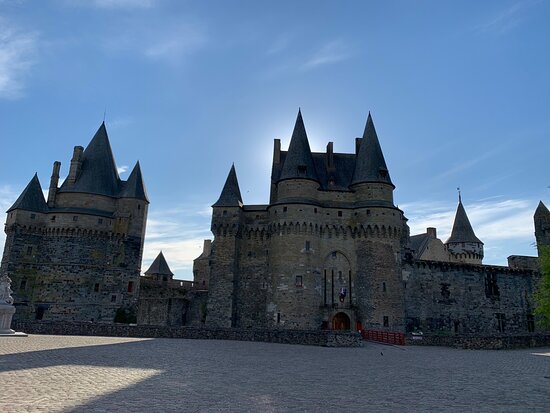
The width and height of the screenshot is (550, 413). In order to click on chimneys in this screenshot , I will do `click(53, 184)`, `click(76, 159)`, `click(278, 152)`, `click(327, 150)`, `click(434, 237)`.